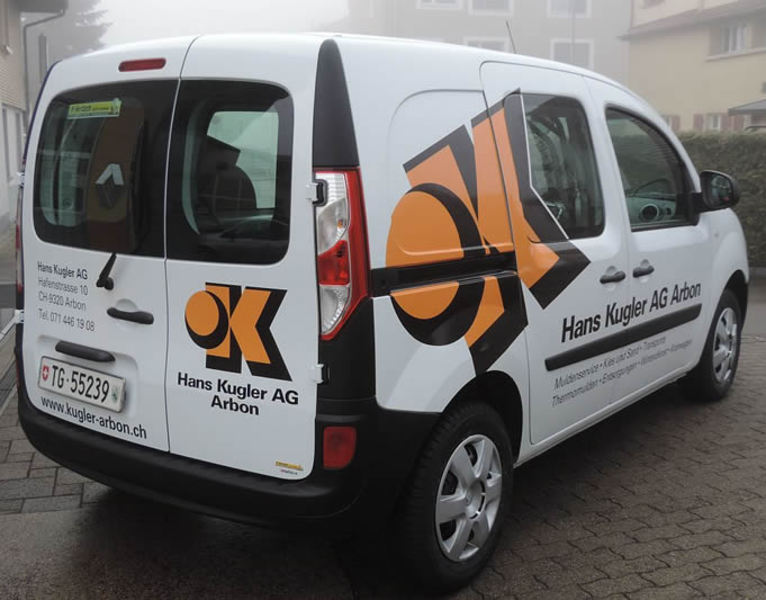
You are a GUI agent. You are given a task and a screenshot of the screen. Output one action in this format:
    pyautogui.click(x=<x>, y=<y>)
    Task: Click on the side windows
    This screenshot has height=600, width=766.
    Given the screenshot: What is the action you would take?
    pyautogui.click(x=567, y=193), pyautogui.click(x=650, y=182)